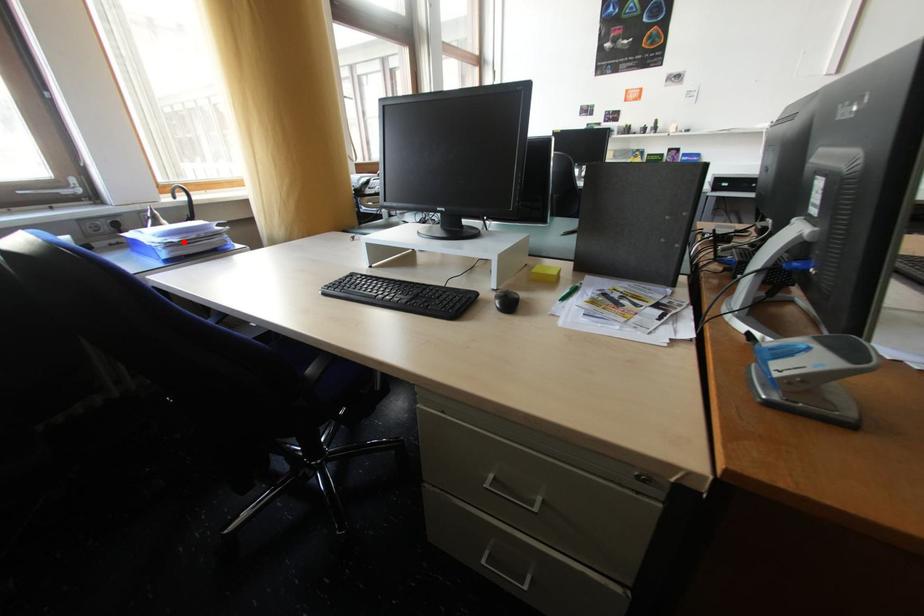
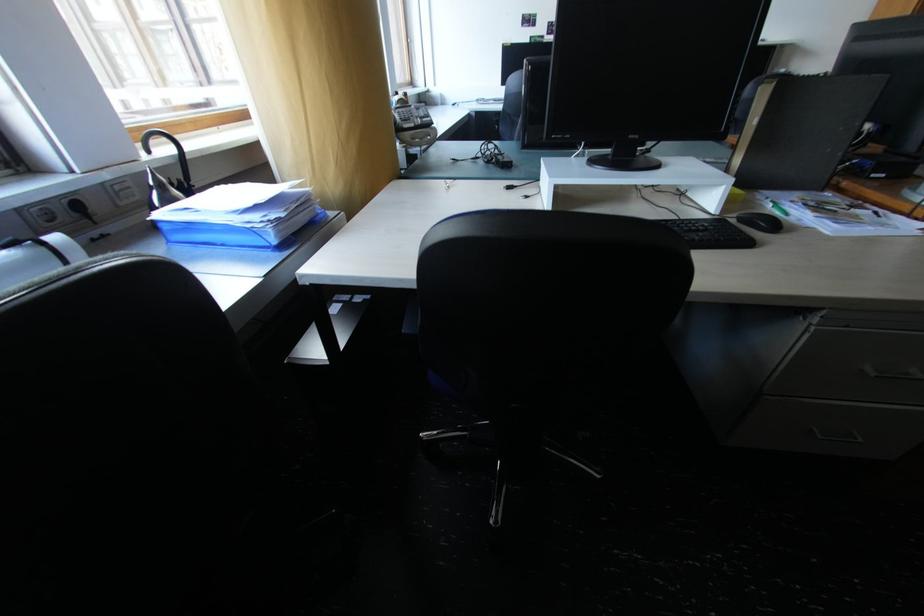
Find the pixel in the second image that matches the highlighted location in the first image.

(290, 216)